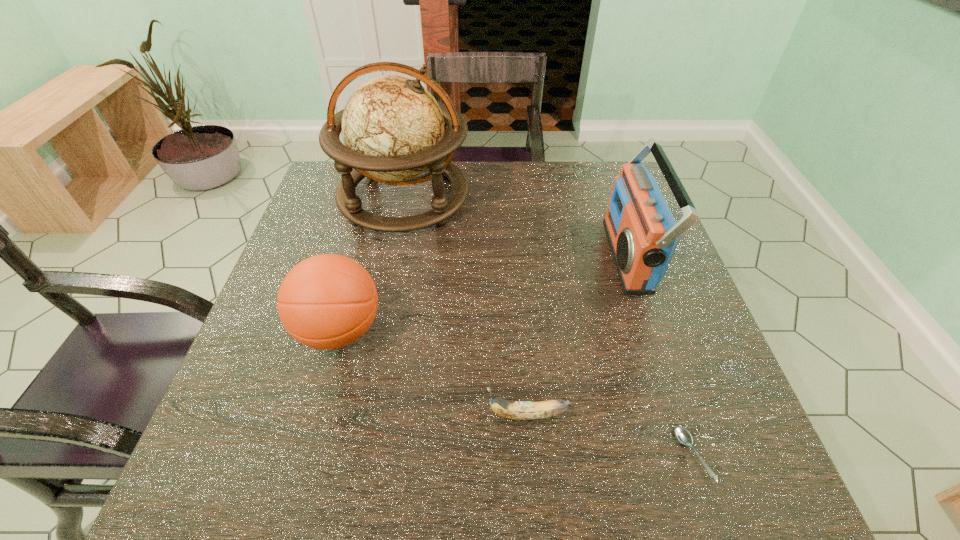
At what (x,y) coordinates should I click in order to perform the action: click on radio receiver at the right edge. Please return your answer as a coordinate pair (x, y). The width and height of the screenshot is (960, 540). Looking at the image, I should click on (642, 233).

In order to click on soupspoon that is positioned at the right edge in this screenshot , I will do coord(683,436).

You are a GUI agent. You are given a task and a screenshot of the screen. Output one action in this format:
    pyautogui.click(x=<x>, y=<y>)
    Task: Click on the object situated at the far left corner
    
    Given the screenshot: What is the action you would take?
    pyautogui.click(x=394, y=130)

Identify the location of object at the near right corner. The width and height of the screenshot is (960, 540). (683, 436).

Image resolution: width=960 pixels, height=540 pixels. In the image, there is a desktop. Find the location of `vacant area at the far edge`. vacant area at the far edge is located at coordinates [468, 176].

The image size is (960, 540). What are the coordinates of `free region at the right edge of the desktop` in the screenshot? It's located at (625, 319).

Where is `free space at the far left corner`? free space at the far left corner is located at coordinates (312, 205).

In the image, there is a desktop. Where is `vacant space at the near left corner`? The height and width of the screenshot is (540, 960). vacant space at the near left corner is located at coordinates (234, 463).

You are a GUI agent. You are given a task and a screenshot of the screen. Output one action in this format:
    pyautogui.click(x=<x>, y=<y>)
    Task: Click on the vacant area at the far right corner of the desktop
    
    Given the screenshot: What is the action you would take?
    pyautogui.click(x=611, y=183)

In the image, there is a desktop. Where is `vacant space at the near right corner`? vacant space at the near right corner is located at coordinates (670, 456).